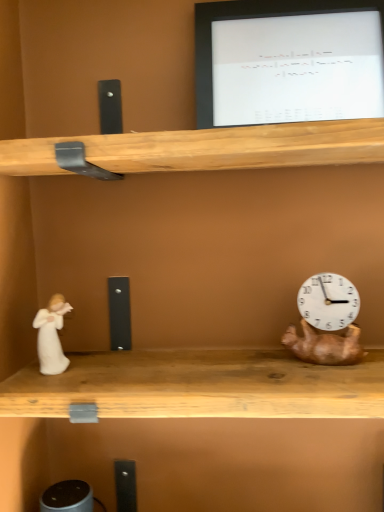
This screenshot has height=512, width=384. Describe the element at coordinates (326, 322) in the screenshot. I see `copper metallic clock at right` at that location.

In order to face copper metallic clock at right, should I rotate leftwards or rightwards?

It's best to rotate right around 17.040 degrees.

Identify the location of copper metallic clock at right. (326, 322).

Identify the location of computer monitor that appears on the left of copper metallic clock at right. The image size is (384, 512). (286, 58).

From the image's perspective, which one is positioned higher, copper metallic clock at right or white glossy monitor at upper center?

white glossy monitor at upper center, from the image's perspective.

Based on their sizes in the image, would you say copper metallic clock at right is bigger or smaller than white glossy monitor at upper center?

Considering their sizes, copper metallic clock at right takes up less space than white glossy monitor at upper center.

Considering the positions of points (330, 342) and (381, 106), is point (330, 342) farther from camera compared to point (381, 106)?

No, (330, 342) is closer to viewer.

The width and height of the screenshot is (384, 512). I want to click on couple below the white glossy monitor at upper center (from the image's perspective), so click(51, 336).

Which is more to the left, white glossy monitor at upper center or white porcelain figurine at left?

From the viewer's perspective, white porcelain figurine at left appears more on the left side.

Which of these two, white glossy monitor at upper center or white porcelain figurine at left, is smaller?

Smaller between the two is white porcelain figurine at left.

Can you see copper metallic clock at right touching white porcelain figurine at left?

copper metallic clock at right and white porcelain figurine at left are not in contact.

How different are the orientations of copper metallic clock at right and white porcelain figurine at left in degrees?

There is a 11.7-degree angle between the facing directions of copper metallic clock at right and white porcelain figurine at left.

From the image's perspective, which one is positioned lower, copper metallic clock at right or white porcelain figurine at left?

white porcelain figurine at left, from the image's perspective.

How far apart are white porcelain figurine at left and white glossy monitor at upper center?

The distance of white porcelain figurine at left from white glossy monitor at upper center is 21.50 inches.

Is white porcelain figurine at left next to white glossy monitor at upper center?

white porcelain figurine at left and white glossy monitor at upper center are clearly separated.

How many degrees apart are the facing directions of white porcelain figurine at left and white glossy monitor at upper center?

The angular difference between white porcelain figurine at left and white glossy monitor at upper center is 2.08 degrees.

Does white porcelain figurine at left have a greater width compared to white glossy monitor at upper center?

In fact, white porcelain figurine at left might be narrower than white glossy monitor at upper center.

Looking at this image, considering the relative sizes of white porcelain figurine at left and copper metallic clock at right in the image provided, is white porcelain figurine at left bigger than copper metallic clock at right?

No.

Is white porcelain figurine at left taller or shorter than copper metallic clock at right?

In the image, white porcelain figurine at left appears to be shorter than copper metallic clock at right.

Looking at this image, measure the distance between white porcelain figurine at left and copper metallic clock at right.

They are 41.88 centimeters apart.

Is white porcelain figurine at left turned away from copper metallic clock at right?

No, copper metallic clock at right is not at the back of white porcelain figurine at left.

Can you confirm if white glossy monitor at upper center is taller than copper metallic clock at right?

Correct, white glossy monitor at upper center is much taller as copper metallic clock at right.

From the image's perspective, is white glossy monitor at upper center under copper metallic clock at right?

Incorrect, from the image's perspective, white glossy monitor at upper center is higher than copper metallic clock at right.

Does point (216, 60) come closer to viewer compared to point (288, 335)?

No.

In order to click on toy that appears on the right of white glossy monitor at upper center in this screenshot , I will do `click(326, 322)`.

Locate an element on the screen. Image resolution: width=384 pixels, height=512 pixels. toy directly beneath the white glossy monitor at upper center (from a real-world perspective) is located at coordinates (326, 322).

Find the location of a particular element. couple that is behind the white glossy monitor at upper center is located at coordinates (51, 336).

Looking at this image, from the image, which object appears to be farther from copper metallic clock at right, white porcelain figurine at left or white glossy monitor at upper center?

white porcelain figurine at left lies further to copper metallic clock at right than the other object.

From the image, which object appears to be farther from white glossy monitor at upper center, white porcelain figurine at left or copper metallic clock at right?

white porcelain figurine at left.

When comparing their distances from white porcelain figurine at left, does copper metallic clock at right or white glossy monitor at upper center seem further?

white glossy monitor at upper center is further to white porcelain figurine at left.

Based on their spatial positions, is copper metallic clock at right or white porcelain figurine at left closer to white glossy monitor at upper center?

Among the two, copper metallic clock at right is located nearer to white glossy monitor at upper center.

Which object lies nearer to the anchor point white porcelain figurine at left, white glossy monitor at upper center or copper metallic clock at right?

copper metallic clock at right lies closer to white porcelain figurine at left than the other object.

Which object lies further to the anchor point copper metallic clock at right, white glossy monitor at upper center or white porcelain figurine at left?

white porcelain figurine at left is positioned further to the anchor copper metallic clock at right.

The width and height of the screenshot is (384, 512). Find the location of `toy between white glossy monitor at upper center and white porcelain figurine at left vertically`. toy between white glossy monitor at upper center and white porcelain figurine at left vertically is located at coordinates (326, 322).